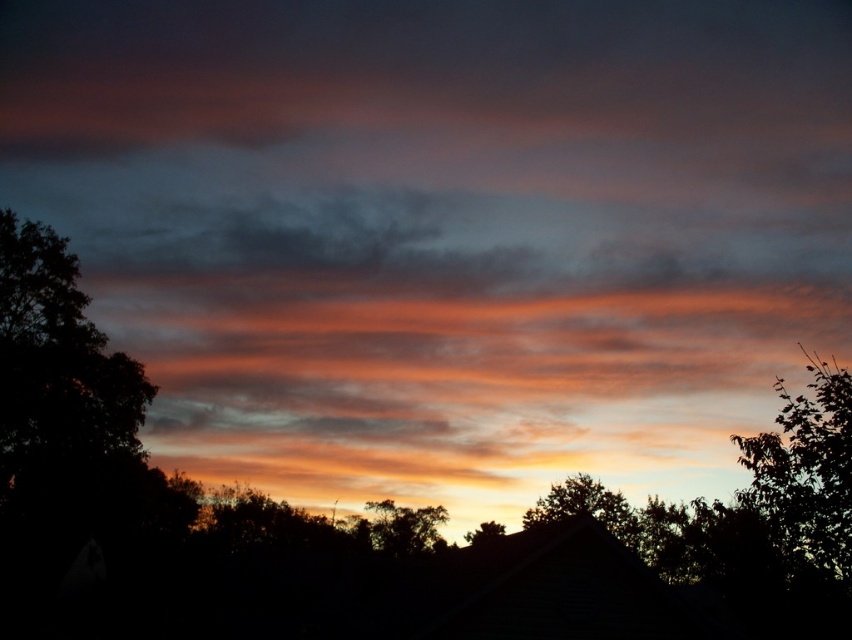
Question: Does dark green leafy tree at left lie in front of green leafy tree at right?

Choices:
 (A) no
 (B) yes

Answer: (A)

Question: Does dark green leafy tree at left have a smaller size compared to silvery metallic tree at center?

Choices:
 (A) no
 (B) yes

Answer: (B)

Question: Estimate the real-world distances between objects in this image. Which object is farther from the green leafy tree at right?

Choices:
 (A) silhouette leafy tree at center
 (B) dark green leafy tree at left

Answer: (A)

Question: Which object appears farthest from the camera in this image?

Choices:
 (A) silhouette leafy tree at center
 (B) silvery metallic tree at center

Answer: (A)

Question: Can you confirm if dark green leafy tree at left is wider than silvery metallic tree at center?

Choices:
 (A) no
 (B) yes

Answer: (A)

Question: Which is nearer to the silvery metallic tree at center?

Choices:
 (A) green leafy tree at right
 (B) silhouette leafy tree at center
 (C) dark green leafy tree at left

Answer: (B)